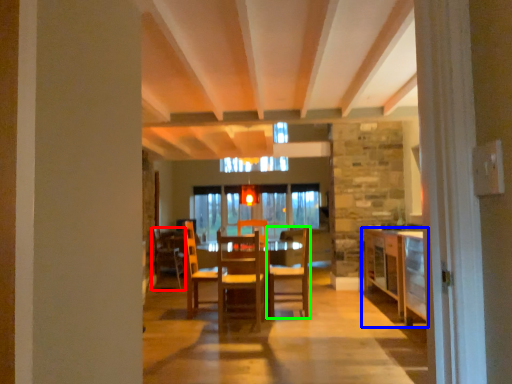
Question: Which object is positioned farthest from chair (highlighted by a red box)? Select from cabinetry (highlighted by a blue box) and chair (highlighted by a green box).

Choices:
 (A) cabinetry
 (B) chair

Answer: (A)